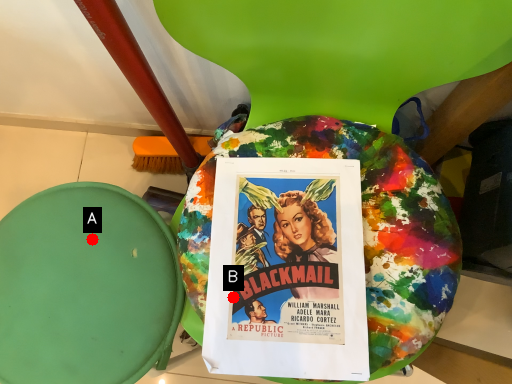
Question: Two points are circled on the image, labeled by A and B beside each circle. Which point is closer to the camera?

Choices:
 (A) A is closer
 (B) B is closer

Answer: (B)